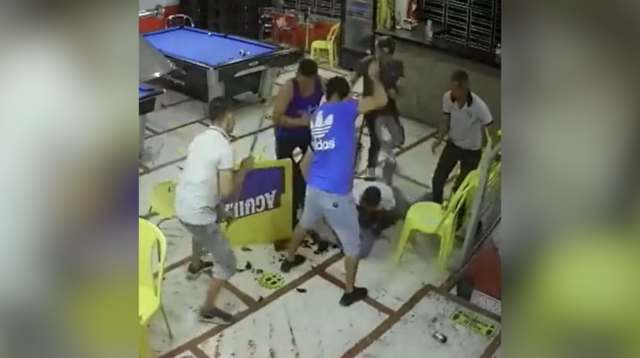
In order to click on empty space on countertop in this screenshot , I will do `click(461, 50)`.